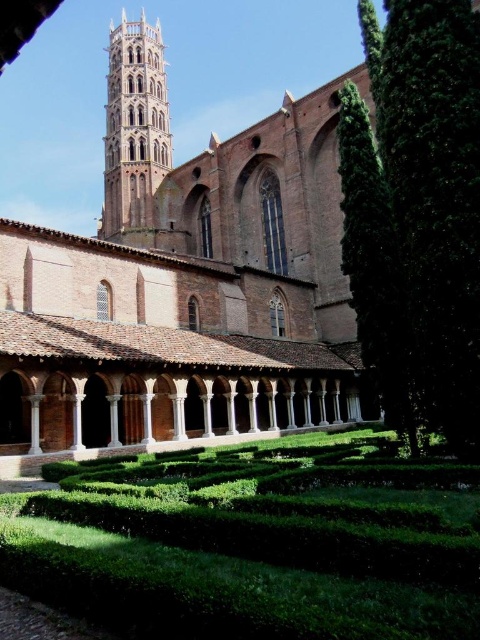
You are standing in the courtyard and want to see the top of the brown brick tower at upper left. Can you see it clearly from your current position, considering the height of the green hedge maze at lower center?

The green hedge maze at lower center is shorter than the brown brick tower at upper left, so yes, you can see the top of the brown brick tower at upper left clearly as it is taller than the maze.

You are a visitor standing in the courtyard and want to take a photo of the brown brick church at center and the green leafy hedge at right. Which object should you focus on first if you want to capture both in a single frame without moving the camera?

You should focus on the brown brick church at center first because it is taller than the green leafy hedge at right, allowing you to frame it centrally while still capturing the hedge in the background.